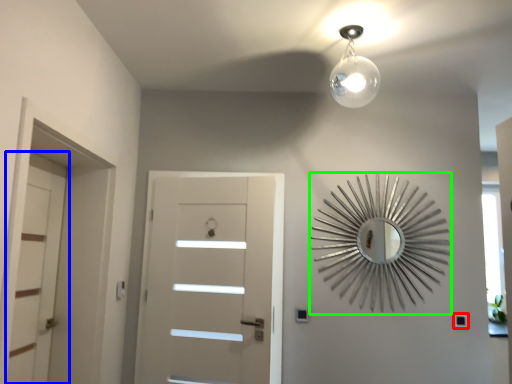
Question: Which object is positioned farthest from light switch (highlighted by a red box)? Select from door (highlighted by a blue box) and design (highlighted by a green box).

Choices:
 (A) door
 (B) design

Answer: (A)